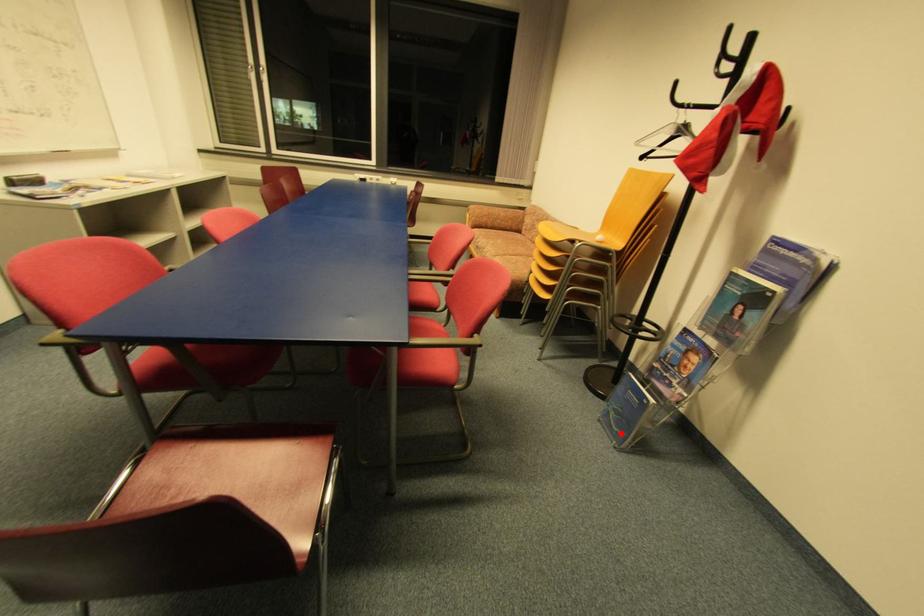
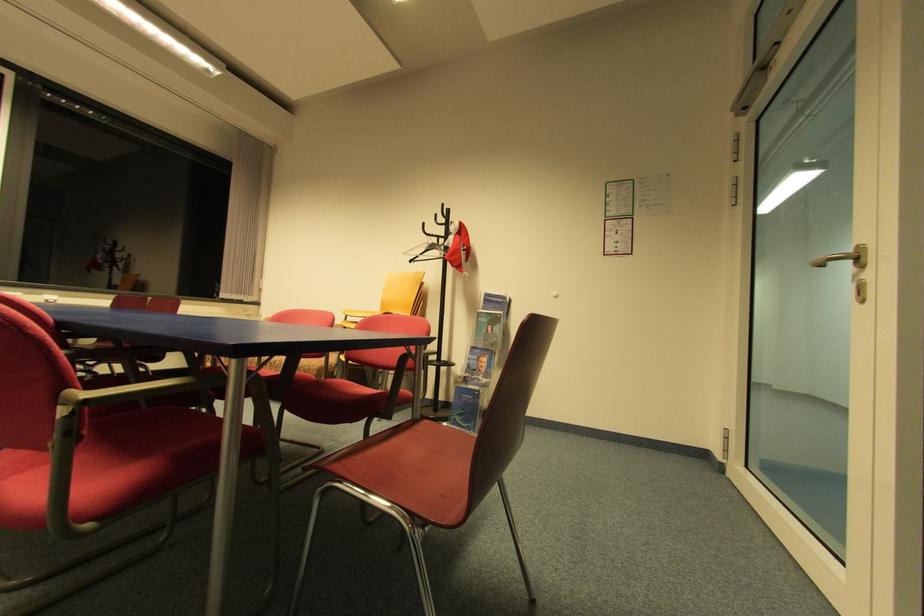
Question: I am providing you with two images of the same scene from different viewpoints. A red point is marked on the first image. At the location where the point appears in image 1, is it still visible in image 2?

Choices:
 (A) Yes
 (B) No

Answer: (A)